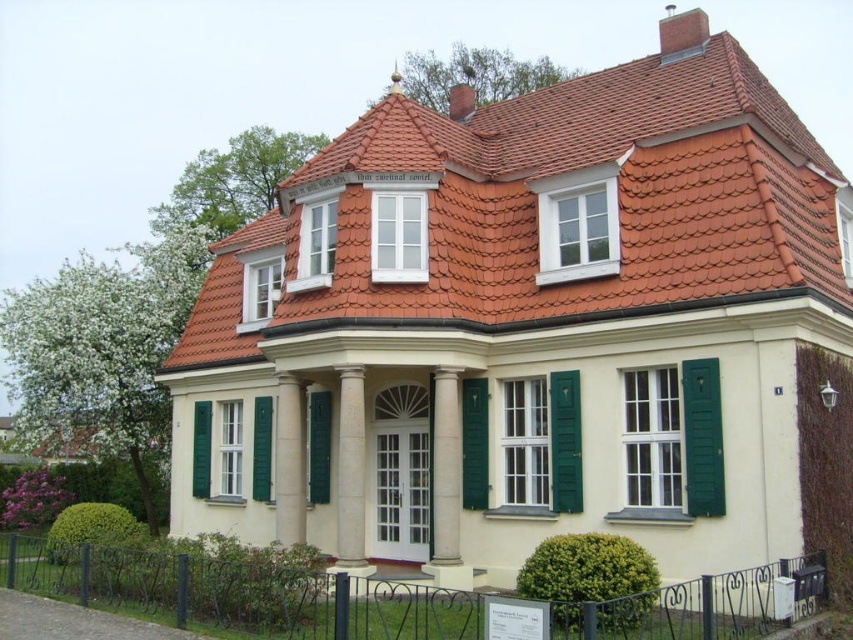
Which of these two, terracotta clay tiles at upper center or green matte shutter at left, stands taller?

Standing taller between the two is terracotta clay tiles at upper center.

Is terracotta clay tiles at upper center further to the viewer compared to green matte shutter at left?

No, terracotta clay tiles at upper center is closer to the viewer.

Locate an element on the screen. The image size is (853, 640). terracotta clay tiles at upper center is located at coordinates (535, 208).

I want to click on terracotta clay tiles at upper center, so click(535, 208).

Is green matte shutter at center bigger than green matte shutter at left?

Yes.

What do you see at coordinates (318, 445) in the screenshot? This screenshot has width=853, height=640. I see `green matte shutter at center` at bounding box center [318, 445].

Find the location of a particular element. Image resolution: width=853 pixels, height=640 pixels. green matte shutter at center is located at coordinates (318, 445).

Who is positioned more to the left, terracotta clay tiles at upper center or green matte shutter at center?

green matte shutter at center

Is point (709, 300) closer to camera compared to point (318, 461)?

Yes, it is in front of point (318, 461).

Does point (700, 259) come behind point (310, 490)?

No, (700, 259) is in front of (310, 490).

Locate an element on the screen. terracotta clay tiles at upper center is located at coordinates (535, 208).